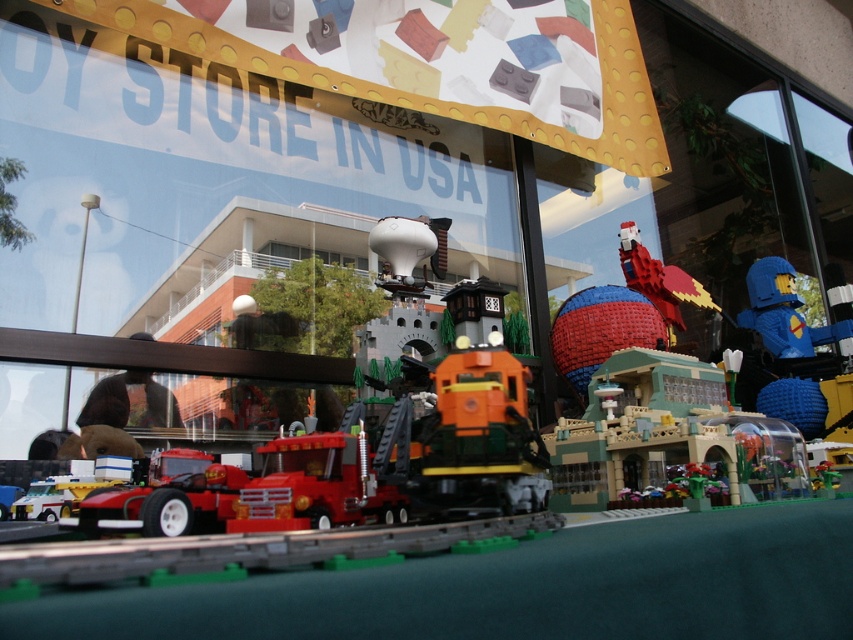
Can you confirm if matte red truck at center is positioned to the left of clear glass window at center?

No, matte red truck at center is not to the left of clear glass window at center.

You are a GUI agent. You are given a task and a screenshot of the screen. Output one action in this format:
    pyautogui.click(x=<x>, y=<y>)
    Task: Click on the matte red truck at center
    This screenshot has width=853, height=640.
    Given the screenshot: What is the action you would take?
    pyautogui.click(x=262, y=493)

Does matte red truck at center appear under brick red bird at upper right?

Yes, matte red truck at center is below brick red bird at upper right.

Who is more forward, (322,464) or (656,291)?

Positioned in front is point (322,464).

The image size is (853, 640). I want to click on matte red truck at center, so click(262, 493).

Can you confirm if brick red bird at upper right is positioned to the right of clear glass window at center?

Yes, brick red bird at upper right is to the right of clear glass window at center.

Does point (695, 289) come closer to viewer compared to point (300, 256)?

No.

Between point (643, 252) and point (285, 246), which one is positioned behind?

Point (643, 252)

Locate an element on the screen. brick red bird at upper right is located at coordinates (659, 278).